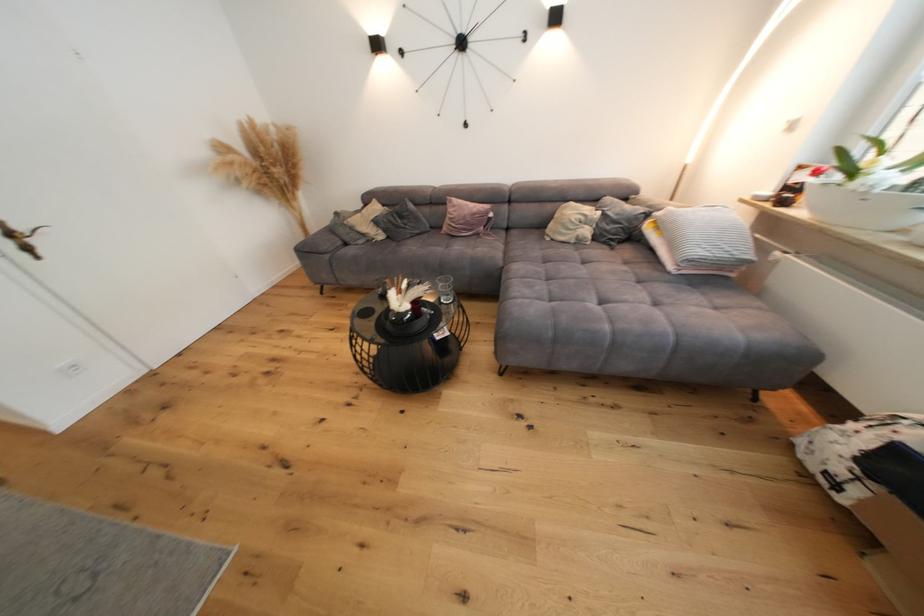
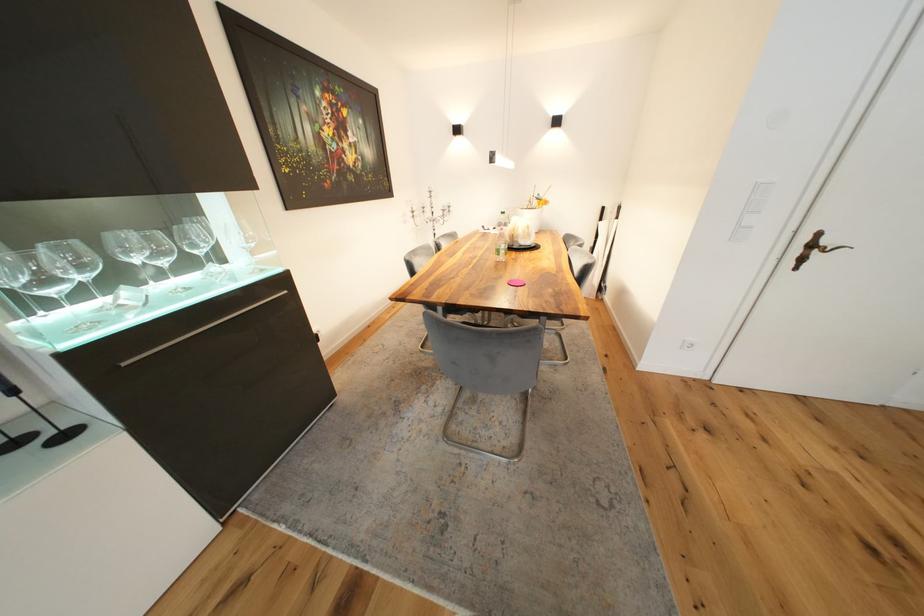
The first image is from the beginning of the video and the second image is from the end. How did the camera likely rotate when shooting the video?

The camera's rotation is toward left-down.